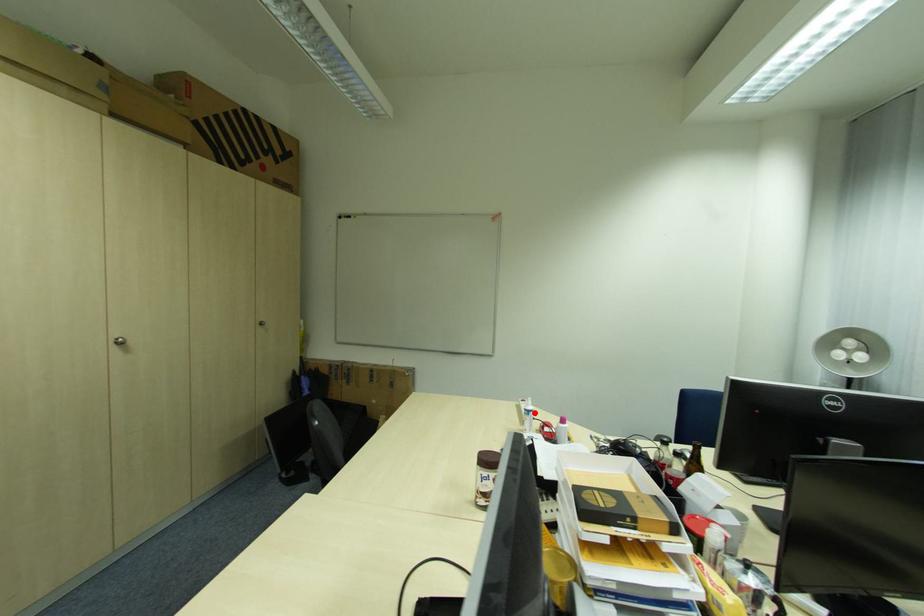
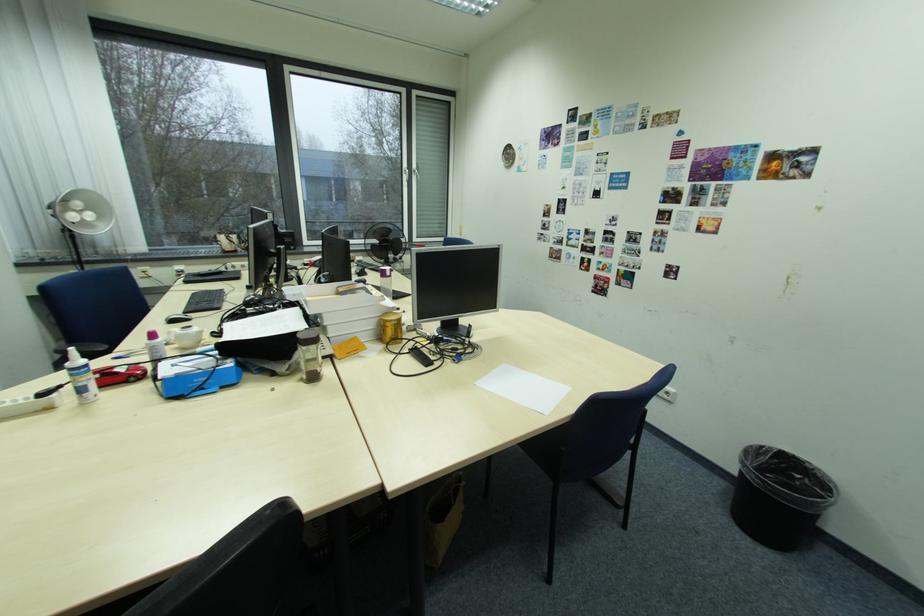
The point at the highlighted location is marked in the first image. Where is the corresponding point in the second image?

(94, 370)